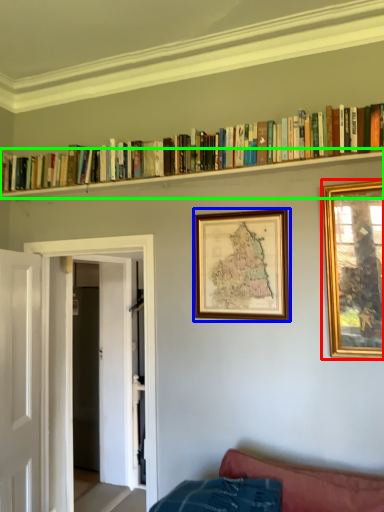
Question: Estimate the real-world distances between objects in this image. Which object is closer to picture frame (highlighted by a red box), picture frame (highlighted by a blue box) or shelf (highlighted by a green box)?

Choices:
 (A) picture frame
 (B) shelf

Answer: (A)